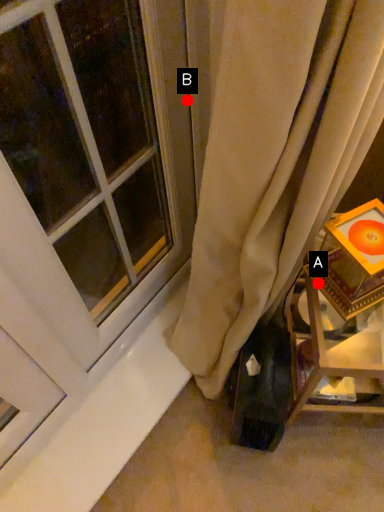
Question: Two points are circled on the image, labeled by A and B beside each circle. Which of the following is the farthest from the observer?

Choices:
 (A) A is further
 (B) B is further

Answer: (B)